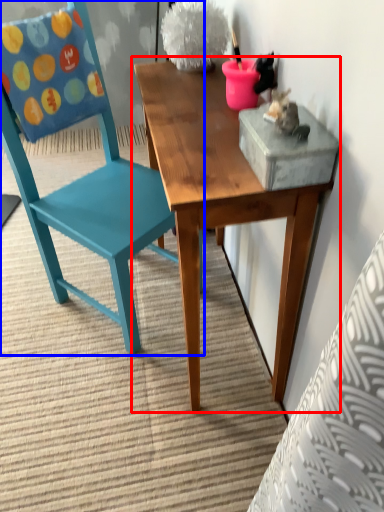
Question: Which object is further to the camera taking this photo, table (highlighted by a red box) or chair (highlighted by a blue box)?

Choices:
 (A) table
 (B) chair

Answer: (B)